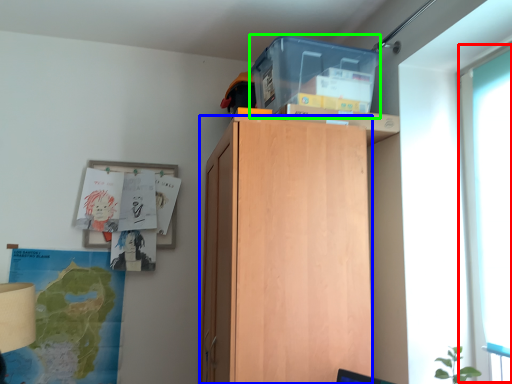
Question: Which object is the closest to the glass door (highlighted by a red box)? Choose among these: cabinetry (highlighted by a blue box) or storage box (highlighted by a green box).

Choices:
 (A) cabinetry
 (B) storage box

Answer: (B)